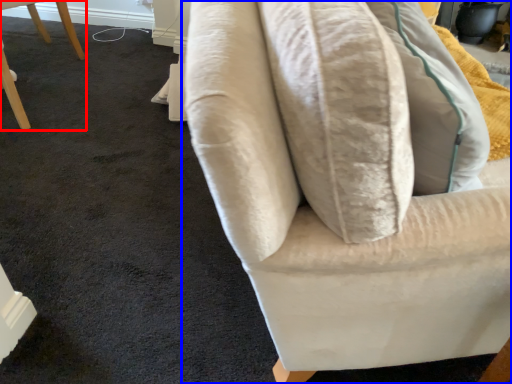
Question: Which object is further to the camera taking this photo, chair (highlighted by a red box) or furniture (highlighted by a blue box)?

Choices:
 (A) chair
 (B) furniture

Answer: (A)